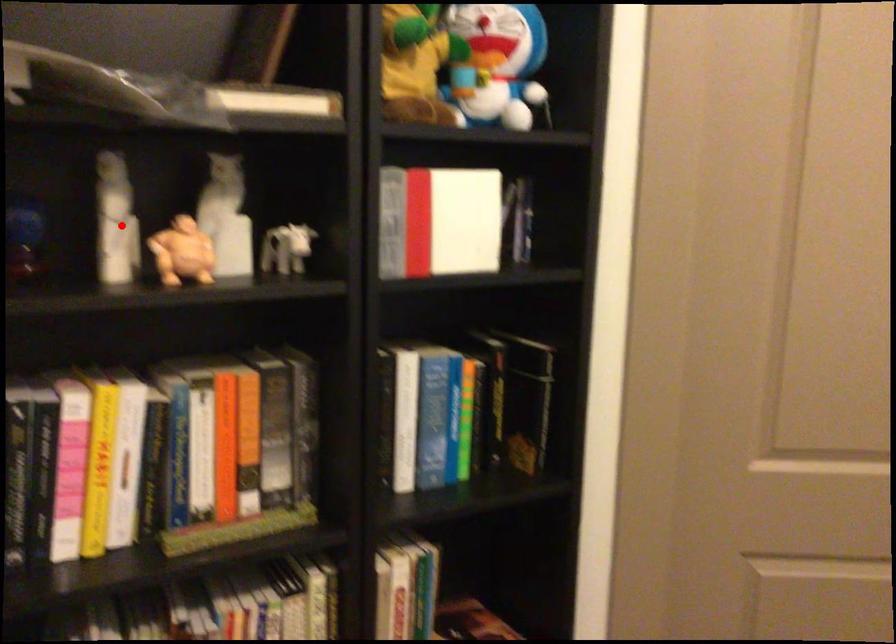
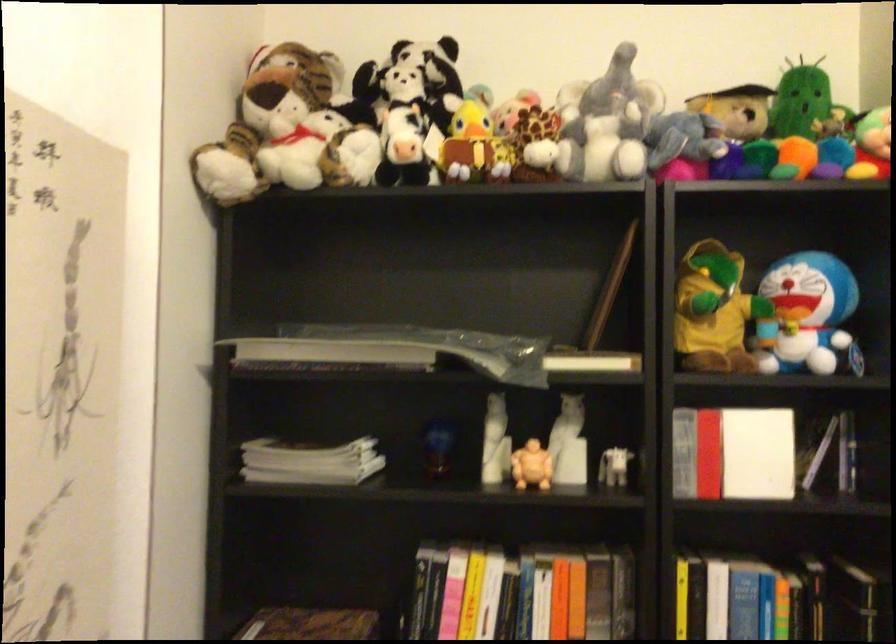
Question: A red point is marked in image1. In image2, is the corresponding 3D point closer to the camera or farther? Reply with the corresponding letter.

Choices:
 (A) The corresponding 3D point is closer.
 (B) The corresponding 3D point is farther.

Answer: (B)